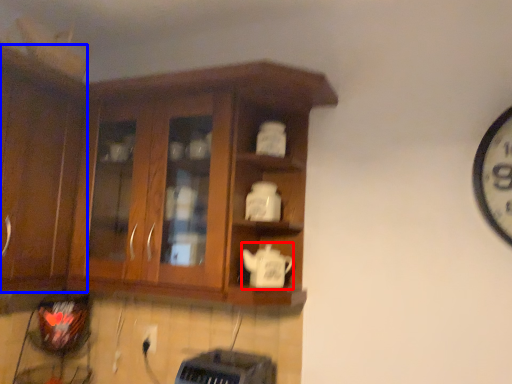
Question: Which object is closer to the camera taking this photo, teapot (highlighted by a red box) or cabinetry (highlighted by a blue box)?

Choices:
 (A) teapot
 (B) cabinetry

Answer: (B)